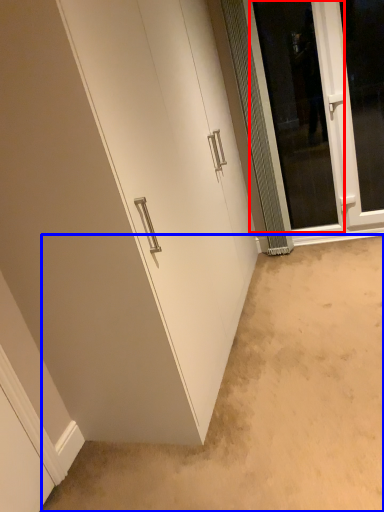
Question: Which of the following is the closest to the observer, screen door (highlighted by a red box) or plain (highlighted by a blue box)?

Choices:
 (A) screen door
 (B) plain

Answer: (B)